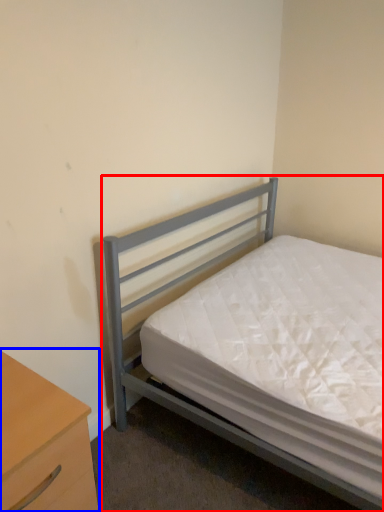
Question: Which of the following is the closest to the observer, bed (highlighted by a red box) or nightstand (highlighted by a blue box)?

Choices:
 (A) bed
 (B) nightstand

Answer: (B)